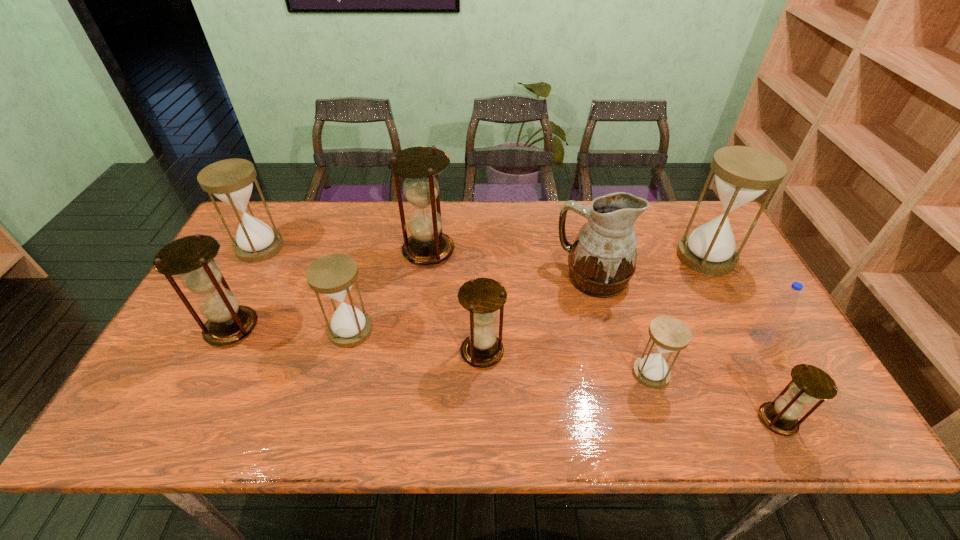
This screenshot has width=960, height=540. I want to click on vacant space that is in between the second brown hourglass from right to left and the second nearest white hourglass, so click(417, 341).

This screenshot has height=540, width=960. In order to click on vacant area between the nearest brown hourglass and the second biggest brown hourglass in this screenshot , I will do `click(505, 374)`.

Locate an element on the screen. empty location between the brown pitcher and the nearest white hourglass is located at coordinates (622, 325).

Point out which object is positioned as the nearest to the fourth hourglass from right to left. Please provide its 2D coordinates. Your answer should be formatted as a tuple, i.e. [(x, y)], where the tuple contains the x and y coordinates of a point satisfying the conditions above.

[(602, 260)]

Locate which object is the second closest to the second white hourglass from left to right. Please provide its 2D coordinates. Your answer should be formatted as a tuple, i.e. [(x, y)], where the tuple contains the x and y coordinates of a point satisfying the conditions above.

[(192, 257)]

Locate which hourglass ranks in proximity to the third hourglass from right to left. Please provide its 2D coordinates. Your answer should be formatted as a tuple, i.e. [(x, y)], where the tuple contains the x and y coordinates of a point satisfying the conditions above.

[(809, 383)]

Select which hourglass appears as the closest to the brown pitcher. Please provide its 2D coordinates. Your answer should be formatted as a tuple, i.e. [(x, y)], where the tuple contains the x and y coordinates of a point satisfying the conditions above.

[(742, 174)]

In order to click on brown hourglass identified as the third closest to the second white hourglass from left to right in this screenshot , I will do `click(482, 297)`.

Where is `brown hourglass that is the closest to the nearest hourglass`? Image resolution: width=960 pixels, height=540 pixels. brown hourglass that is the closest to the nearest hourglass is located at coordinates (x=482, y=297).

Identify which white hourglass is the second closest to the third smallest brown hourglass. Please provide its 2D coordinates. Your answer should be formatted as a tuple, i.e. [(x, y)], where the tuple contains the x and y coordinates of a point satisfying the conditions above.

[(333, 275)]